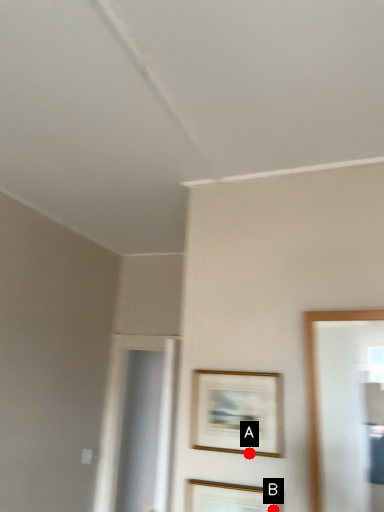
Question: Two points are circled on the image, labeled by A and B beside each circle. Which point appears closest to the camera in this image?

Choices:
 (A) A is closer
 (B) B is closer

Answer: (B)